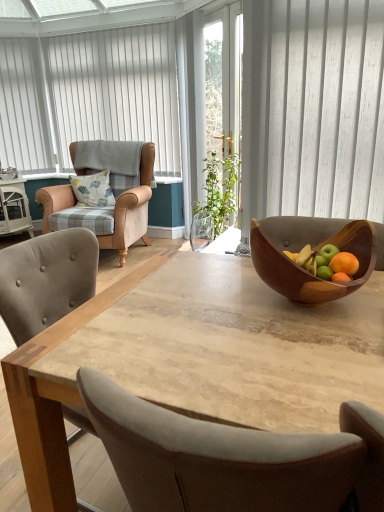
Where is `empty space that is ontop of natural wood table at center (from a real-world perspective)`? Image resolution: width=384 pixels, height=512 pixels. empty space that is ontop of natural wood table at center (from a real-world perspective) is located at coordinates (225, 316).